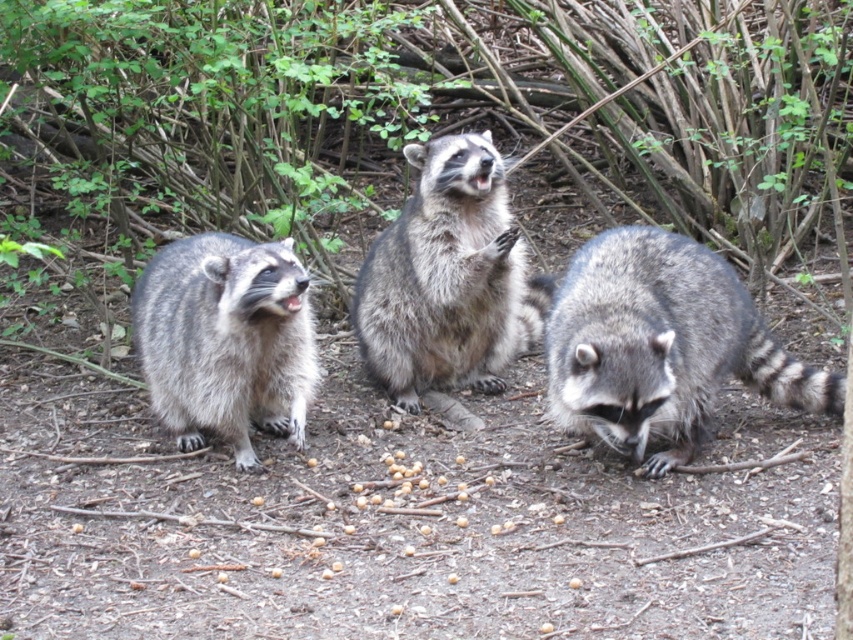
Question: Is gray fur raccoon at lower right above gray fur raccoon at left?

Choices:
 (A) no
 (B) yes

Answer: (A)

Question: Which point appears closest to the camera in this image?

Choices:
 (A) (248, 326)
 (B) (628, 256)
 (C) (392, 320)

Answer: (A)

Question: Which object appears farthest from the camera in this image?

Choices:
 (A) gray fur raccoon at lower right
 (B) gray fur raccoon at left
 (C) fuzzy gray raccoon at center

Answer: (C)

Question: Does fuzzy gray raccoon at center lie in front of gray fur raccoon at left?

Choices:
 (A) yes
 (B) no

Answer: (B)

Question: Considering the real-world distances, which object is farthest from the fuzzy gray raccoon at center?

Choices:
 (A) gray fur raccoon at left
 (B) gray fur raccoon at lower right

Answer: (A)

Question: Does gray fur raccoon at lower right appear under fuzzy gray raccoon at center?

Choices:
 (A) yes
 (B) no

Answer: (A)